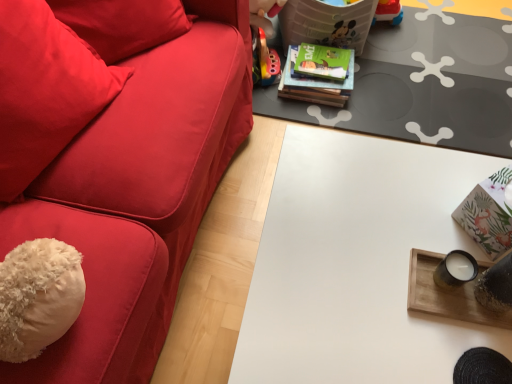
Image resolution: width=512 pixels, height=384 pixels. I want to click on spots to the right of green matte book at upper center, so click(381, 78).